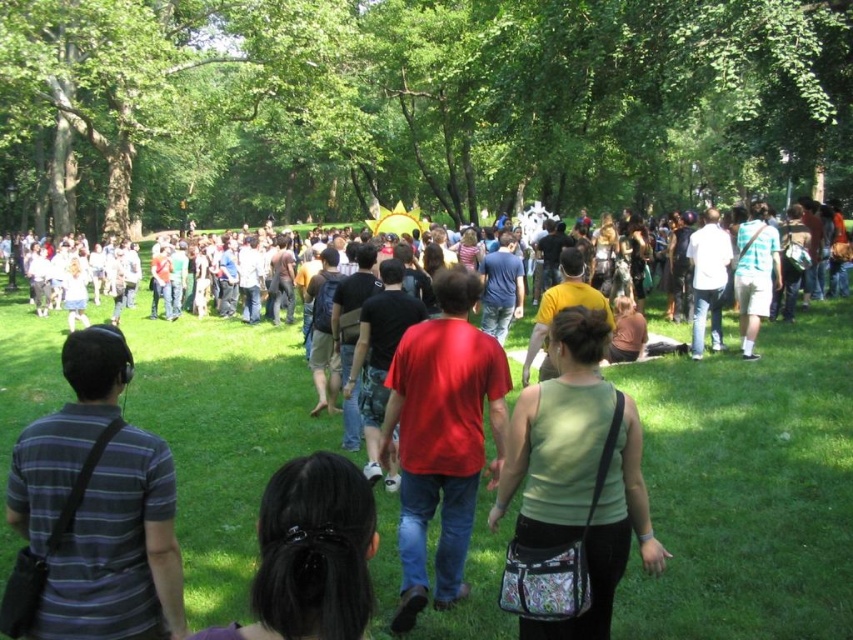
Is black hair at center positioned in front of light blue shirt at center?

Yes, black hair at center is in front of light blue shirt at center.

Is black hair at center positioned behind light blue shirt at center?

No, black hair at center is closer to the viewer.

Is point (328, 612) farther from camera compared to point (758, 224)?

No.

Locate an element on the screen. The height and width of the screenshot is (640, 853). black hair at center is located at coordinates (310, 554).

Who is taller, striped cotton shirt at left or green fabric purse at center?

Standing taller between the two is green fabric purse at center.

Is striped cotton shirt at left thinner than green fabric purse at center?

In fact, striped cotton shirt at left might be wider than green fabric purse at center.

Image resolution: width=853 pixels, height=640 pixels. Describe the element at coordinates (91, 513) in the screenshot. I see `striped cotton shirt at left` at that location.

Locate an element on the screen. striped cotton shirt at left is located at coordinates (91, 513).

Between green fabric purse at center and light blue shirt at center, which one appears on the left side from the viewer's perspective?

green fabric purse at center

In the scene shown: Between green fabric purse at center and light blue shirt at center, which one has more height?

With more height is green fabric purse at center.

Is point (558, 412) positioned behind point (743, 328)?

No, it is in front of (743, 328).

Image resolution: width=853 pixels, height=640 pixels. I want to click on green fabric purse at center, so click(572, 492).